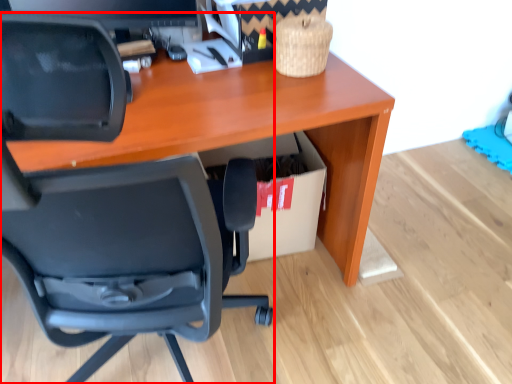
Question: From the image's perspective, where is chair (annotated by the red box) located relative to cardboard box?

Choices:
 (A) above
 (B) below

Answer: (B)